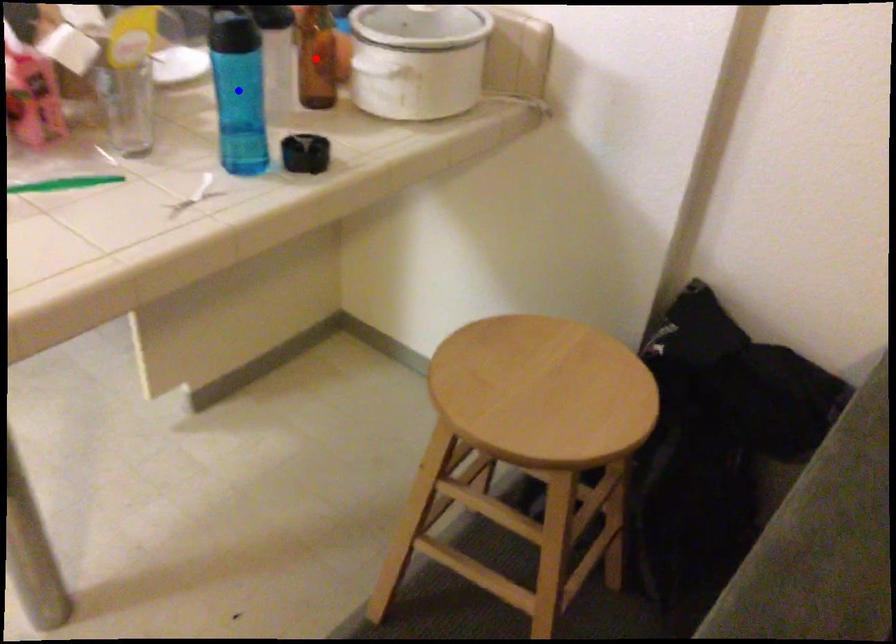
Question: In the image, two points are highlighted. Which point is nearer to the camera? Reply with the corresponding letter.

Choices:
 (A) blue point
 (B) red point

Answer: (A)